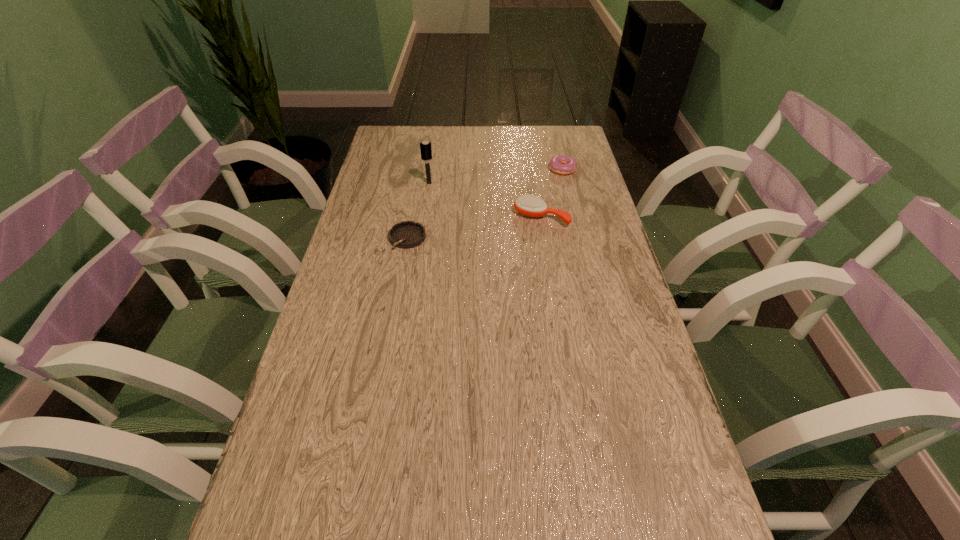
The image size is (960, 540). I want to click on free space between the shorter hairbrush and the ashtray, so click(x=474, y=227).

I want to click on empty location between the doughnut and the left hairbrush, so click(495, 175).

Identify the location of free space between the doughnut and the tallest object. This screenshot has height=540, width=960. (495, 175).

You are a GUI agent. You are given a task and a screenshot of the screen. Output one action in this format:
    pyautogui.click(x=<x>, y=<y>)
    Task: Click on the empty space between the farthest object and the left hairbrush
    The width and height of the screenshot is (960, 540).
    Given the screenshot: What is the action you would take?
    pyautogui.click(x=495, y=175)

Identify the location of vacant space in between the shortest object and the farther hairbrush. The height and width of the screenshot is (540, 960). (419, 211).

Where is `vacant region between the nearer hairbrush and the farthest object`? The image size is (960, 540). vacant region between the nearer hairbrush and the farthest object is located at coordinates (552, 192).

In order to click on vacant region between the left hairbrush and the third shortest object in this screenshot , I will do `click(485, 200)`.

The width and height of the screenshot is (960, 540). In order to click on object that is the nearest to the shortest object in this screenshot , I will do `click(425, 147)`.

I want to click on object identified as the closest to the third tallest object, so click(529, 205).

Select which hairbrush appears as the second closest to the farthest object. Please provide its 2D coordinates. Your answer should be formatted as a tuple, i.e. [(x, y)], where the tuple contains the x and y coordinates of a point satisfying the conditions above.

[(425, 147)]